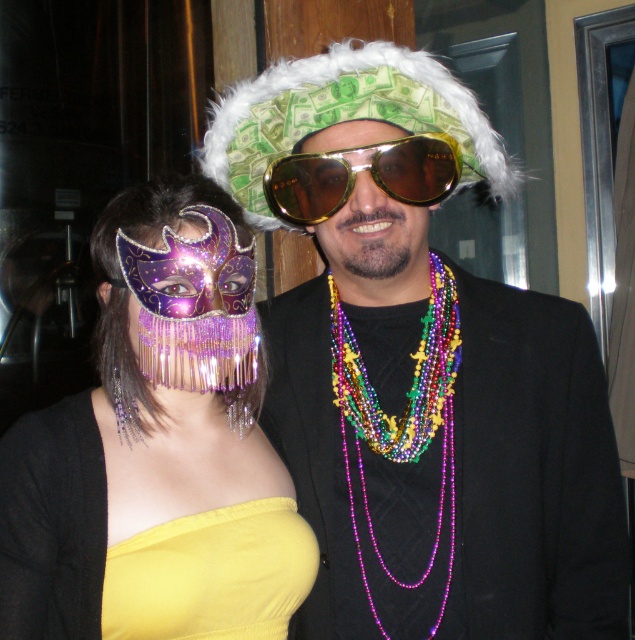
Question: Which object is positioned farthest from the gold reflective sunglasses at center?

Choices:
 (A) yellow satin dress at lower left
 (B) shiny gold sunglasses at center
 (C) metallic purple mask at center

Answer: (A)

Question: Which point is farther from the camera taking this photo?

Choices:
 (A) (173, 593)
 (B) (438, 144)

Answer: (B)

Question: Can you confirm if yellow satin dress at lower left is positioned above multicolored beaded necklace at center?

Choices:
 (A) no
 (B) yes

Answer: (A)

Question: Which point is farther from the camera taking this photo?

Choices:
 (A) (387, 145)
 (B) (241, 260)
 (C) (431, 308)

Answer: (C)

Question: Is metallic purple mask at center wider than gold reflective sunglasses at center?

Choices:
 (A) yes
 (B) no

Answer: (A)

Question: Does metallic purple mask at center have a smaller size compared to gold reflective sunglasses at center?

Choices:
 (A) no
 (B) yes

Answer: (A)